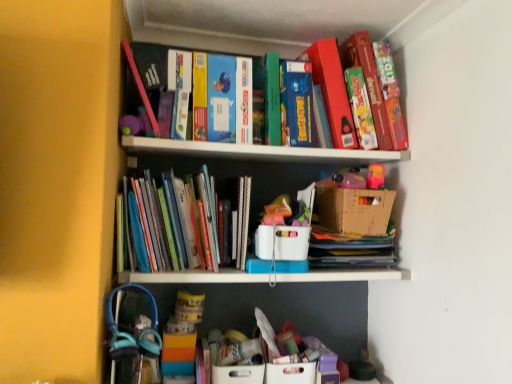
Question: From a real-world perspective, is cardboard box at upper center, which is the first cardboard box in right-to-left order, located higher than white cardboard box at center, the second cardboard box in the right-to-left sequence?

Choices:
 (A) yes
 (B) no

Answer: (A)

Question: From the image's perspective, is cardboard box at upper center, which is the first cardboard box in right-to-left order, beneath white cardboard box at center, positioned as the 1th cardboard box in left-to-right order?

Choices:
 (A) yes
 (B) no

Answer: (B)

Question: Could you tell me if cardboard box at upper center, which is the first cardboard box in right-to-left order, is turned towards white cardboard box at center, positioned as the 1th cardboard box in left-to-right order?

Choices:
 (A) no
 (B) yes

Answer: (A)

Question: Can you confirm if cardboard box at upper center, which is the first cardboard box in right-to-left order, is smaller than white cardboard box at center, positioned as the 1th cardboard box in left-to-right order?

Choices:
 (A) yes
 (B) no

Answer: (B)

Question: From a real-world perspective, does cardboard box at upper center, placed as the second cardboard box when sorted from left to right, sit lower than white cardboard box at center, the second cardboard box in the right-to-left sequence?

Choices:
 (A) yes
 (B) no

Answer: (B)

Question: Which is correct: cardboard box at upper center, placed as the second cardboard box when sorted from left to right, is inside white cardboard box at center, positioned as the 1th cardboard box in left-to-right order, or outside of it?

Choices:
 (A) outside
 (B) inside

Answer: (A)

Question: From the image's perspective, is cardboard box at upper center, placed as the second cardboard box when sorted from left to right, located above or below white cardboard box at center, the second cardboard box in the right-to-left sequence?

Choices:
 (A) below
 (B) above

Answer: (B)

Question: From a real-world perspective, is cardboard box at upper center, which is the first cardboard box in right-to-left order, positioned above or below white cardboard box at center, positioned as the 1th cardboard box in left-to-right order?

Choices:
 (A) below
 (B) above

Answer: (B)

Question: In terms of height, does cardboard box at upper center, placed as the second cardboard box when sorted from left to right, look taller or shorter compared to white cardboard box at center, positioned as the 1th cardboard box in left-to-right order?

Choices:
 (A) tall
 (B) short

Answer: (A)

Question: Considering the positions of hardcover books at center and cardboard box at upper center, which is the first cardboard box in right-to-left order, in the image, is hardcover books at center taller or shorter than cardboard box at upper center, which is the first cardboard box in right-to-left order,?

Choices:
 (A) short
 (B) tall

Answer: (B)

Question: Choose the correct answer: Is hardcover books at center inside cardboard box at upper center, which is the first cardboard box in right-to-left order, or outside it?

Choices:
 (A) outside
 (B) inside

Answer: (A)

Question: Is hardcover books at center wider or thinner than cardboard box at upper center, placed as the second cardboard box when sorted from left to right?

Choices:
 (A) thin
 (B) wide

Answer: (B)

Question: Visually, is hardcover books at center positioned to the left or to the right of cardboard box at upper center, placed as the second cardboard box when sorted from left to right?

Choices:
 (A) right
 (B) left

Answer: (B)

Question: Considering the positions of point pyautogui.click(x=391, y=206) and point pyautogui.click(x=189, y=208), is point pyautogui.click(x=391, y=206) closer or farther from the camera than point pyautogui.click(x=189, y=208)?

Choices:
 (A) closer
 (B) farther

Answer: (B)

Question: From a real-world perspective, is cardboard box at upper center, which is the first cardboard box in right-to-left order, above or below hardcover books at center?

Choices:
 (A) above
 (B) below

Answer: (A)